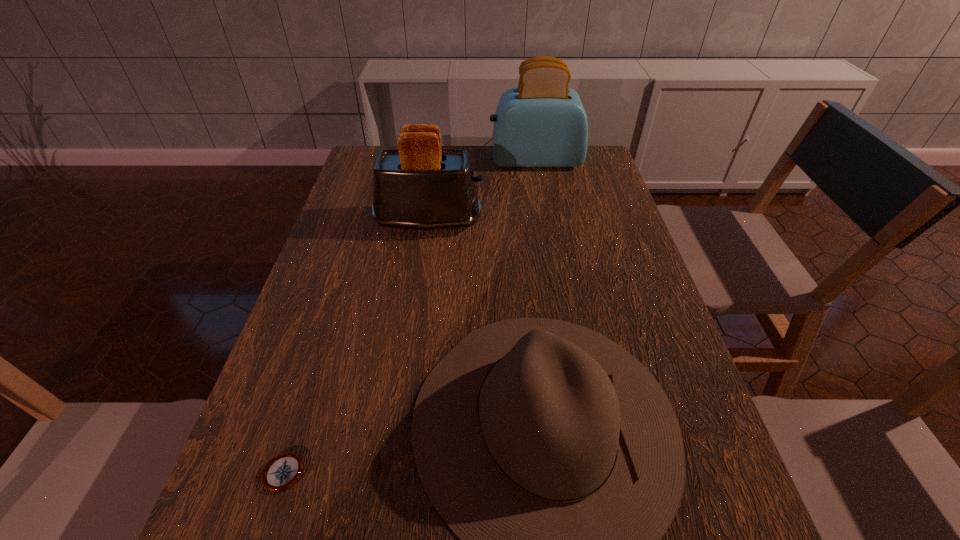
Identify the location of free space between the third nearest object and the compass. Image resolution: width=960 pixels, height=540 pixels. (354, 347).

I want to click on free space between the shortest object and the third nearest object, so click(x=354, y=347).

What are the coordinates of `vacant region between the second farthest object and the right toaster` in the screenshot? It's located at coord(482,191).

Where is `empty space between the compass and the second farthest object`? empty space between the compass and the second farthest object is located at coordinates (354, 347).

Choose which object is the nearest neighbor to the shorter toaster. Please provide its 2D coordinates. Your answer should be formatted as a tuple, i.e. [(x, y)], where the tuple contains the x and y coordinates of a point satisfying the conditions above.

[(541, 123)]

What are the coordinates of `object that is the third closest to the sombrero` in the screenshot? It's located at (541, 123).